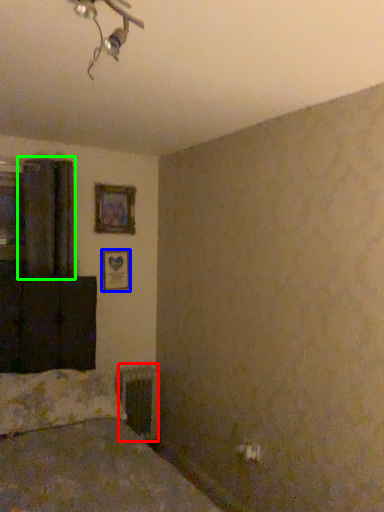
Question: Which object is the closest to the radiator (highlighted by a red box)? Choose among these: picture frame (highlighted by a blue box) or curtain (highlighted by a green box).

Choices:
 (A) picture frame
 (B) curtain

Answer: (A)